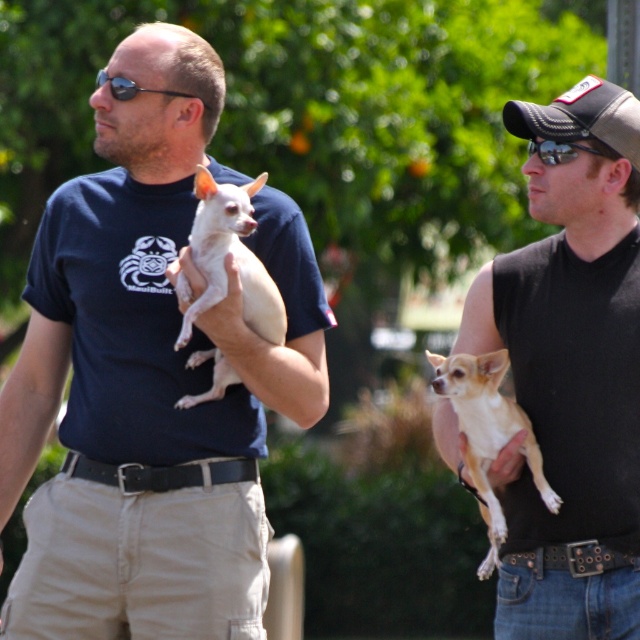
Is matte black t-shirt at center positioned at the back of light brown fur at right?

No, it is in front of light brown fur at right.

Is matte black t-shirt at center thinner than light brown fur at right?

In fact, matte black t-shirt at center might be wider than light brown fur at right.

Find the location of a particular element. Image resolution: width=640 pixels, height=640 pixels. matte black t-shirt at center is located at coordinates (150, 378).

The width and height of the screenshot is (640, 640). What do you see at coordinates (150, 378) in the screenshot?
I see `matte black t-shirt at center` at bounding box center [150, 378].

Who is taller, matte black t-shirt at center or black sleeveless shirt at center?

matte black t-shirt at center is taller.

I want to click on matte black t-shirt at center, so click(x=150, y=378).

Is matte black t-shirt at center behind black plastic sunglasses at upper left?

That is False.

Is matte black t-shirt at center bigger than black plastic sunglasses at upper left?

Correct, matte black t-shirt at center is larger in size than black plastic sunglasses at upper left.

Describe the element at coordinates (150, 378) in the screenshot. I see `matte black t-shirt at center` at that location.

In order to click on matte black t-shirt at center in this screenshot , I will do `click(150, 378)`.